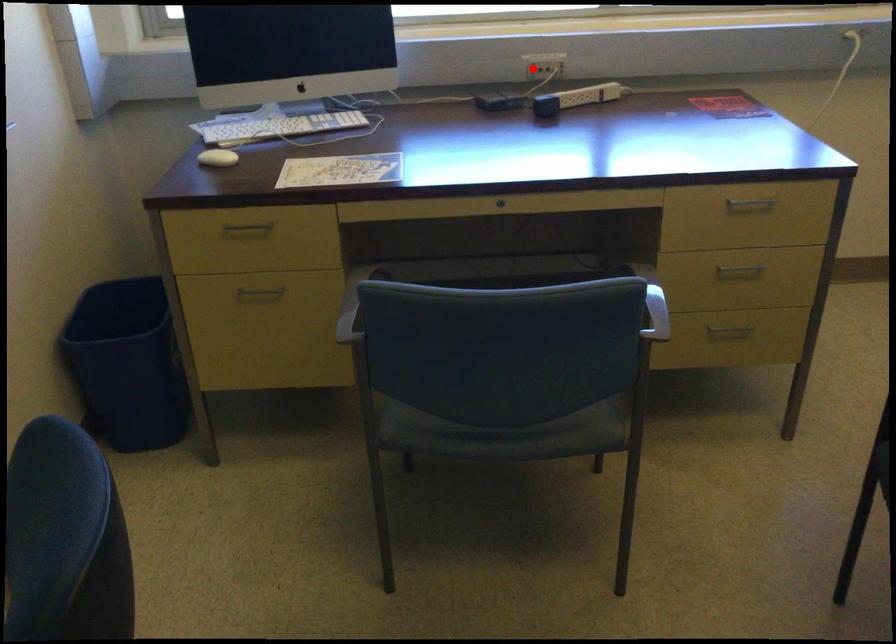
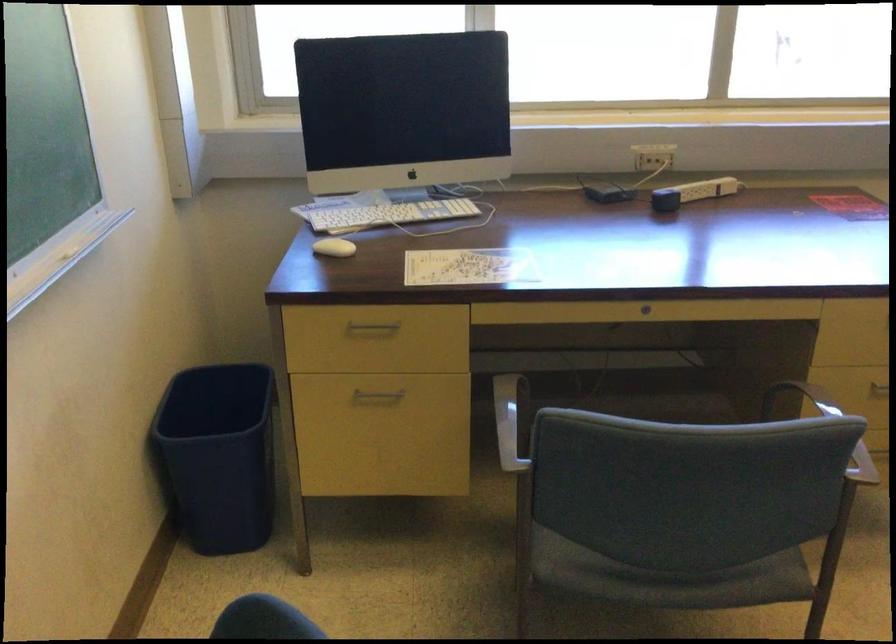
Where in the second image is the point corresponding to the highlighted location from the first image?

(643, 158)